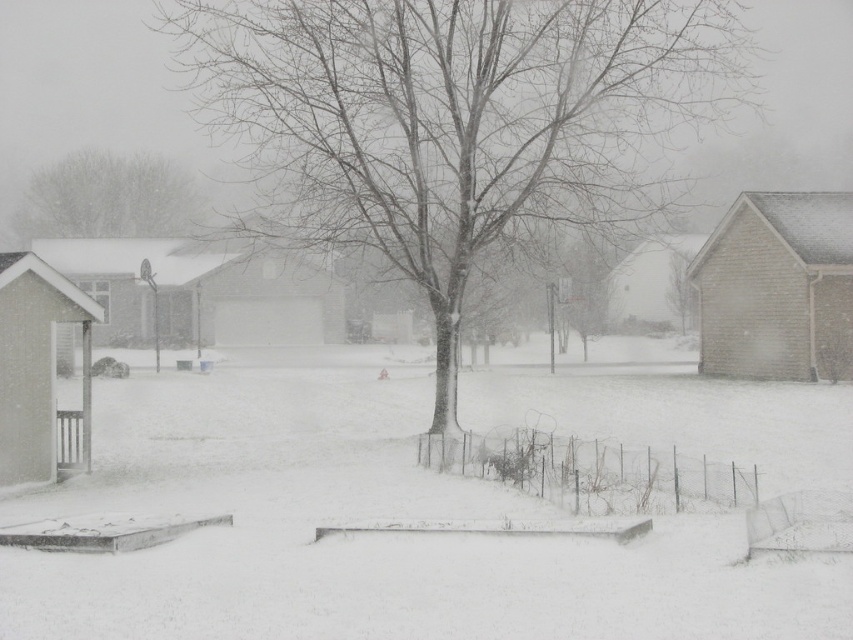
Question: Does brick house at right appear on the left side of white brick garage at center?

Choices:
 (A) no
 (B) yes

Answer: (A)

Question: Which point appears closest to the camera in this image?

Choices:
 (A) (x=82, y=412)
 (B) (x=375, y=356)
 (C) (x=846, y=209)
 (D) (x=637, y=284)

Answer: (A)

Question: Does bare wood tree at center come in front of bare branches at upper left?

Choices:
 (A) yes
 (B) no

Answer: (A)

Question: Which object appears farthest from the camera in this image?

Choices:
 (A) white brick garage at center
 (B) brown wood fence at left
 (C) brown wood shed at lower left
 (D) bare wood tree at center

Answer: (B)

Question: Considering the relative positions of white fluffy snow at center and white matte house at center in the image provided, where is white fluffy snow at center located with respect to white matte house at center?

Choices:
 (A) below
 (B) above

Answer: (A)

Question: Which point is closer to the camera taking this photo?

Choices:
 (A) (374, 51)
 (B) (100, 268)

Answer: (A)